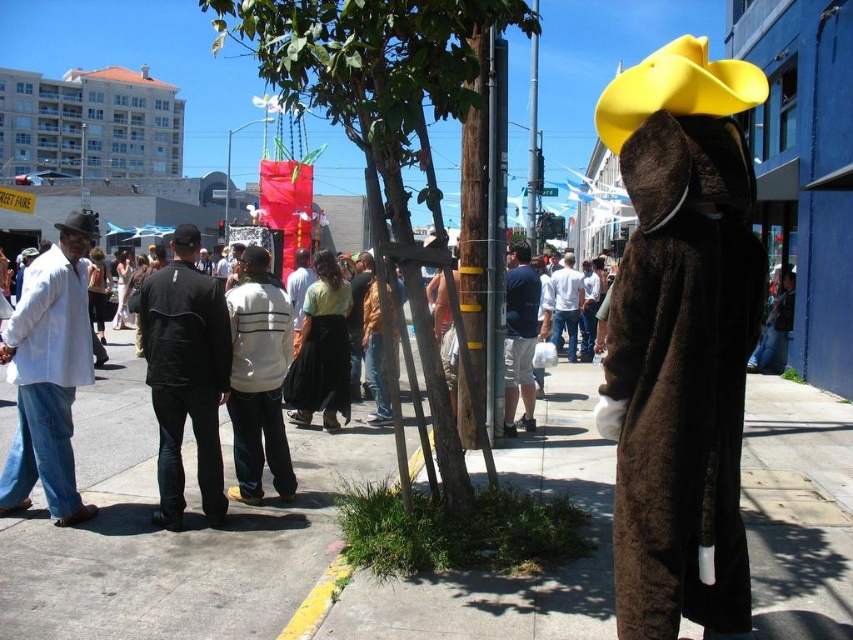
Who is more distant from viewer, (373,230) or (199,477)?

The point (199,477) is behind.

Does green leafy tree at center have a lesser width compared to black fabric jacket at center?

No, green leafy tree at center is not thinner than black fabric jacket at center.

Describe the element at coordinates (383, 116) in the screenshot. I see `green leafy tree at center` at that location.

Identify the location of green leafy tree at center. The image size is (853, 640). (383, 116).

Does green leafy tree at center appear over white cotton shirt at left?

Correct, green leafy tree at center is located above white cotton shirt at left.

Is green leafy tree at center smaller than white cotton shirt at left?

Incorrect, green leafy tree at center is not smaller in size than white cotton shirt at left.

What do you see at coordinates (383, 116) in the screenshot?
I see `green leafy tree at center` at bounding box center [383, 116].

The image size is (853, 640). I want to click on green leafy tree at center, so click(x=383, y=116).

Does green leafy tree at center have a smaller size compared to matte black cowboy hat at left?

Yes.

Does green leafy tree at center appear under matte black cowboy hat at left?

Correct, green leafy tree at center is located below matte black cowboy hat at left.

Between point (383, 172) and point (61, 228), which one is positioned in front?

Positioned in front is point (383, 172).

Find the location of a particular element. green leafy tree at center is located at coordinates (383, 116).